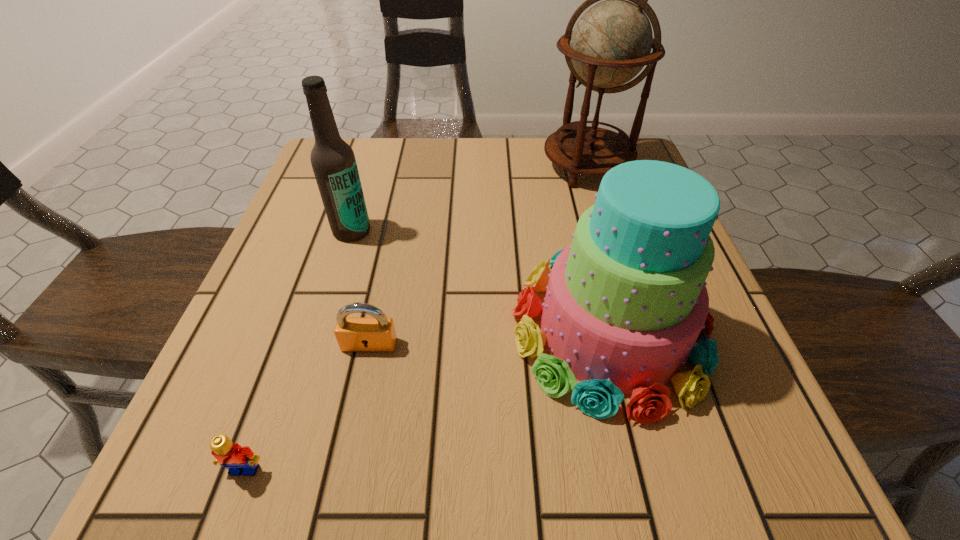
At what (x,y) coordinates should I click in order to perform the action: click on the farthest object. Please return your answer as a coordinate pair (x, y). Looking at the image, I should click on (611, 43).

Where is `the tallest object`? the tallest object is located at coordinates (611, 43).

Identify the location of the second farthest object. The height and width of the screenshot is (540, 960). (333, 161).

Where is `cake`? The height and width of the screenshot is (540, 960). cake is located at coordinates (625, 303).

The width and height of the screenshot is (960, 540). I want to click on padlock, so click(352, 334).

Find the location of a particular element. The width and height of the screenshot is (960, 540). Lego is located at coordinates (238, 460).

Where is `free space located on the surface of the farthest object`? free space located on the surface of the farthest object is located at coordinates (610, 241).

Locate an element on the screen. The width and height of the screenshot is (960, 540). vacant space located on the side of the beer bottle with the label is located at coordinates (x=340, y=269).

Locate an element on the screen. This screenshot has height=540, width=960. blank space located 0.110m on the left of the cake is located at coordinates (444, 330).

You are a GUI agent. You are given a task and a screenshot of the screen. Output one action in this format:
    pyautogui.click(x=<x>, y=<y>)
    Task: Click on the free region located 0.060m to unlock the padlock from the front
    The image size is (960, 540).
    Given the screenshot: What is the action you would take?
    pyautogui.click(x=360, y=387)